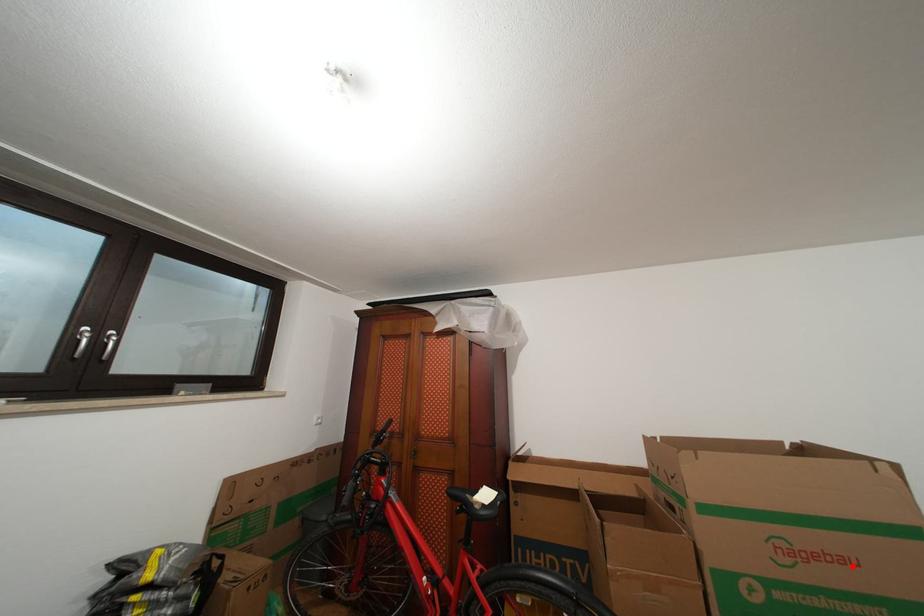
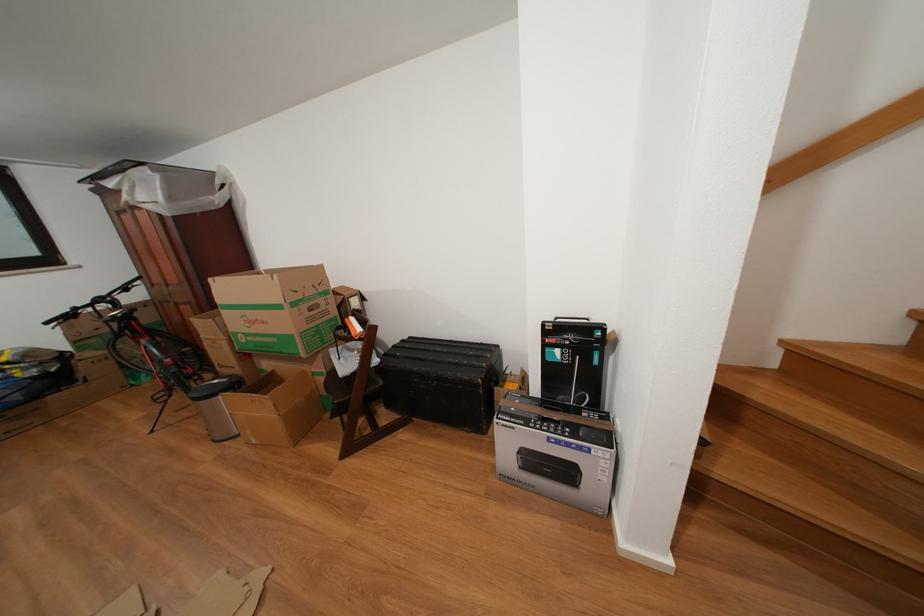
The point at the highlighted location is marked in the first image. Where is the corresponding point in the second image?

(272, 328)